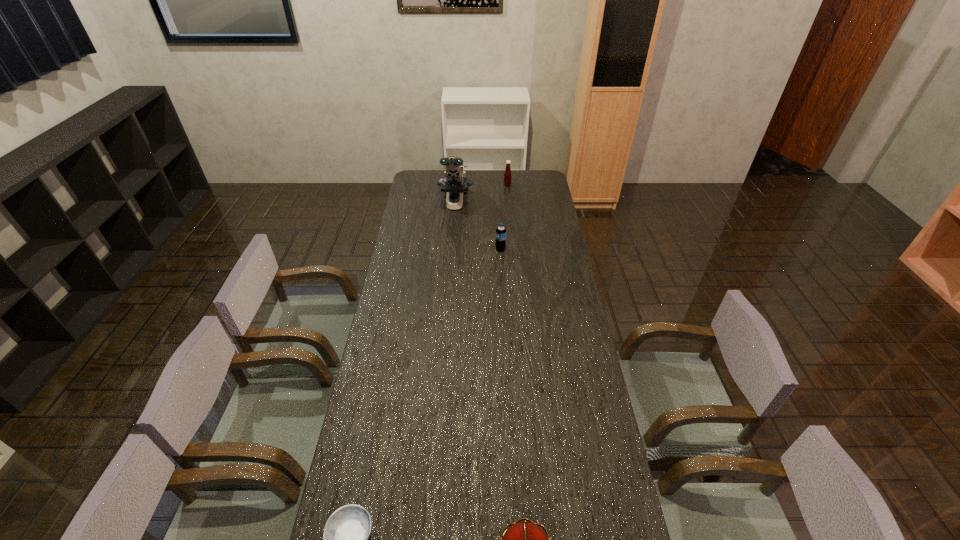
Where is `object situated at the far left corner`? object situated at the far left corner is located at coordinates (455, 183).

Locate an element on the screen. The height and width of the screenshot is (540, 960). free space at the left edge is located at coordinates (387, 402).

Locate an element on the screen. This screenshot has height=540, width=960. vacant region at the right edge of the desktop is located at coordinates (558, 231).

This screenshot has width=960, height=540. In order to click on free space at the far right corner in this screenshot , I will do pyautogui.click(x=546, y=185).

Where is `free point between the third farthest object and the farthest object`? free point between the third farthest object and the farthest object is located at coordinates (504, 217).

Choose which object is the fourth nearest neighbor to the second shortest object. Please provide its 2D coordinates. Your answer should be formatted as a tuple, i.e. [(x, y)], where the tuple contains the x and y coordinates of a point satisfying the conditions above.

[(507, 174)]

Identify the location of object that is the second closest to the Tabasco sauce. (500, 243).

This screenshot has width=960, height=540. What are the coordinates of `free location that satisfies the following two spatial constraints: 1. through the eyepieces of the soda bottle; 2. on the left side of the microscope` in the screenshot? It's located at (451, 249).

I want to click on free spot that satisfies the following two spatial constraints: 1. through the eyepieces of the soda bottle; 2. on the left side of the tallest object, so click(x=451, y=249).

The width and height of the screenshot is (960, 540). I want to click on vacant space that satisfies the following two spatial constraints: 1. on the back side of the soda bottle; 2. on the left side of the Tabasco sauce, so click(497, 185).